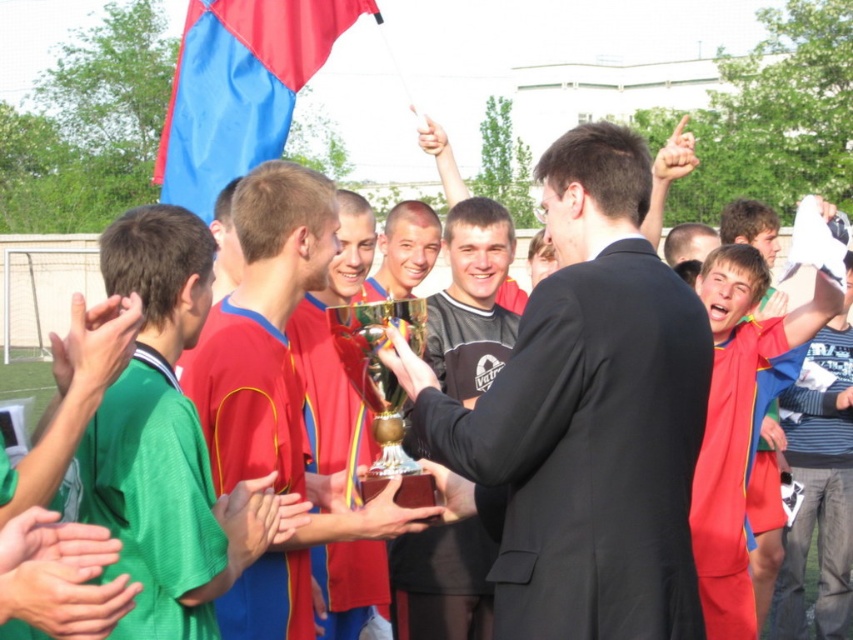
Based on the photo, you are a photographer at this soccer celebration. You need to capture a photo where both the gold shiny trophy at center and the brown wooden trophy at center are visible. Which trophy should you position to the right to include both in the frame?

The gold shiny trophy at center is already positioned on the right side of the brown wooden trophy at center, so you should keep the camera focused to ensure both are visible with the gold shiny trophy at center on the right.

What are the coordinates of the brown wooden trophy at center?

The brown wooden trophy at center is located at point (386, 525).